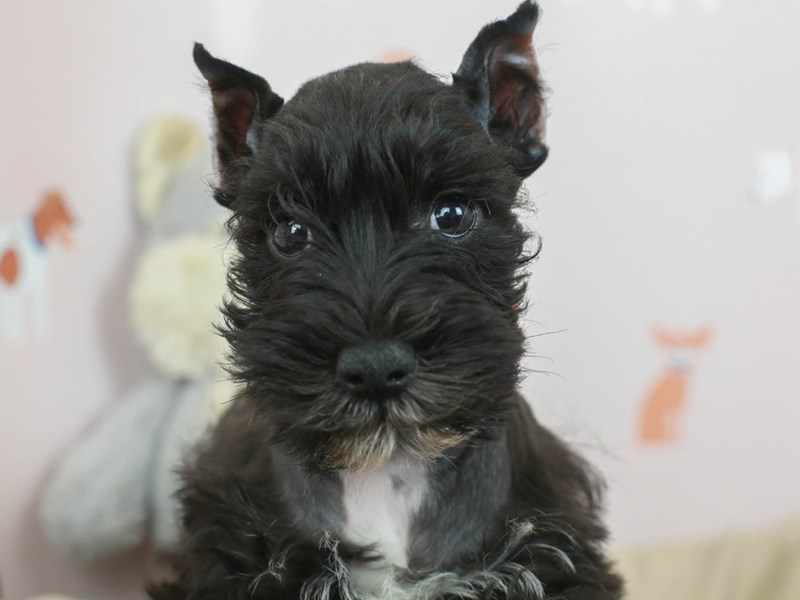
I want to click on blurry white wall, so click(604, 166).